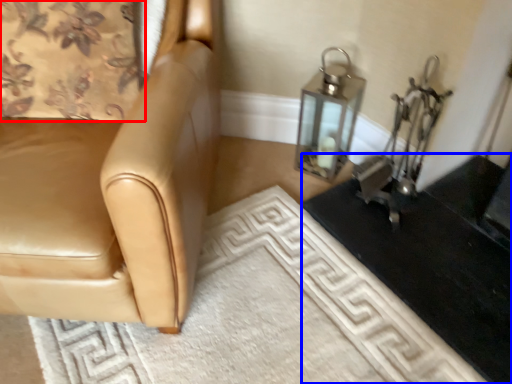
Question: Which object is further to the camera taking this photo, curtain (highlighted by a red box) or table (highlighted by a blue box)?

Choices:
 (A) curtain
 (B) table

Answer: (A)